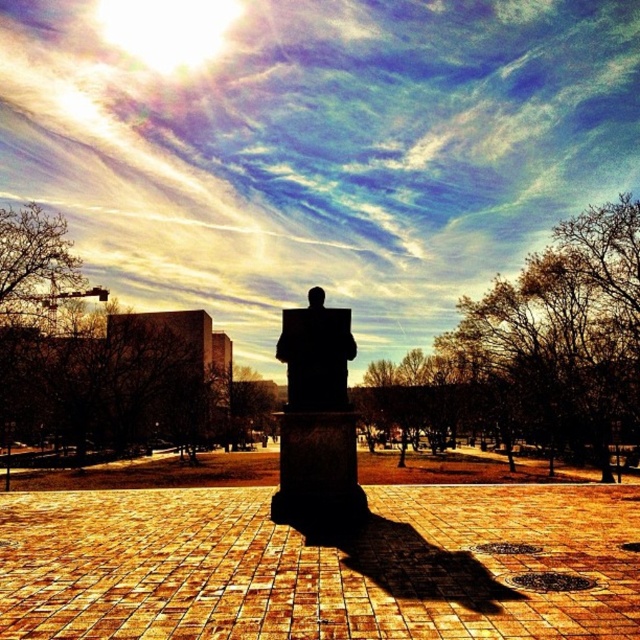
Is silhouette stone statue at center shorter than black stone statue at center?

Answer: Yes, silhouette stone statue at center is shorter than black stone statue at center.

Between point (349, 317) and point (328, 326), which one is positioned behind?

The point (349, 317) is behind.

Where is `silhouette stone statue at center`? The image size is (640, 640). silhouette stone statue at center is located at coordinates (316, 419).